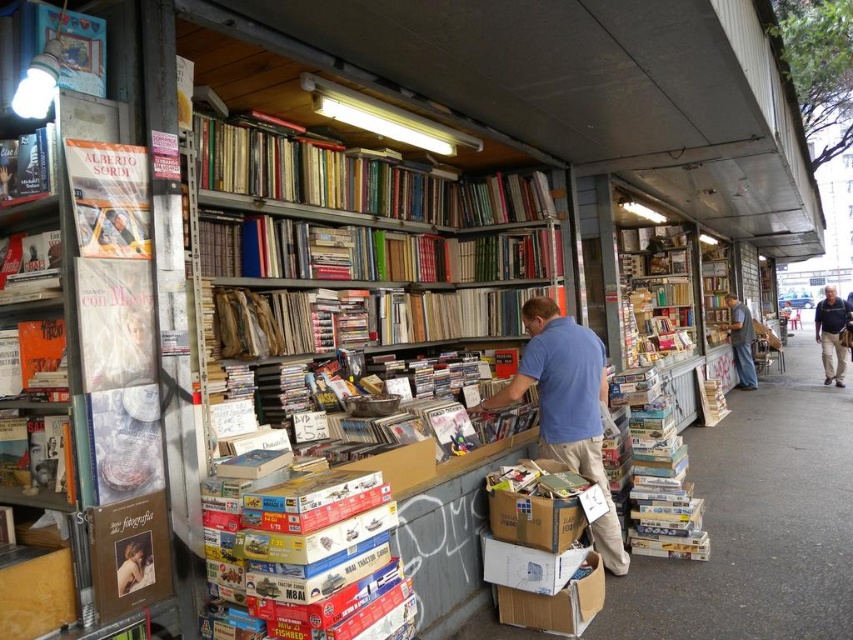
Question: Does hardcover books at right have a smaller size compared to matte black book at upper left?

Choices:
 (A) yes
 (B) no

Answer: (B)

Question: Which point is closer to the camera?

Choices:
 (A) (578, 600)
 (B) (733, 342)
 (C) (363, 252)
 (D) (676, 556)

Answer: (A)

Question: Can you confirm if metallic silver bookshelf at center is positioned to the right of brown leather jacket at lower right?

Choices:
 (A) no
 (B) yes

Answer: (A)

Question: Among these objects, which one is farthest from the camera?

Choices:
 (A) metallic silver bookshelf at center
 (B) blue cotton shirt at center
 (C) brown cardboard box at lower center
 (D) smooth asphalt pavement at center

Answer: (A)

Question: Which object appears farthest from the camera in this image?

Choices:
 (A) blue cotton shirt at center
 (B) brown leather jacket at lower right
 (C) brown cardboard box at lower center
 (D) cardboard box at lower center

Answer: (B)

Question: Is smooth asphalt pavement at center closer to the viewer compared to hardcover books at right?

Choices:
 (A) yes
 (B) no

Answer: (A)